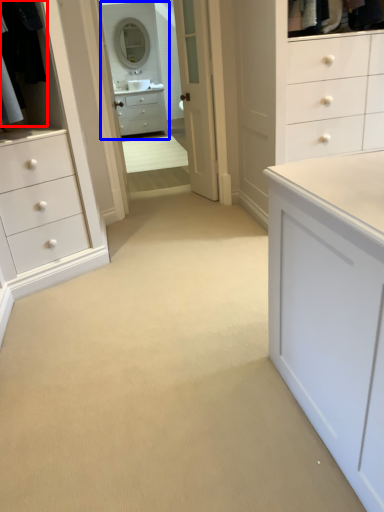
Question: Which object appears farthest to the camera in this image, laundry (highlighted by a red box) or mirror (highlighted by a blue box)?

Choices:
 (A) laundry
 (B) mirror

Answer: (B)